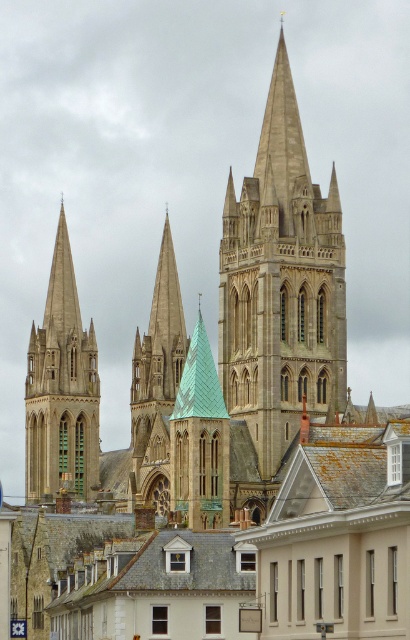
Is the position of light gray stone tower at center more distant than that of stone spire at left?

That is False.

Is point (282, 248) behind point (38, 461)?

No, (282, 248) is in front of (38, 461).

Describe the element at coordinates (280, 284) in the screenshot. I see `light gray stone tower at center` at that location.

Where is `light gray stone tower at center`? This screenshot has height=640, width=410. light gray stone tower at center is located at coordinates (280, 284).

In the scene shown: Is stone spire at left to the left of gray slate roof at center from the viewer's perspective?

Yes, stone spire at left is to the left of gray slate roof at center.

Which of these two, stone spire at left or gray slate roof at center, stands shorter?

With less height is gray slate roof at center.

This screenshot has width=410, height=640. Find the location of `stone spire at left`. stone spire at left is located at coordinates (61, 388).

Does light gray stone tower at center have a greater height compared to gray slate roof at center?

Indeed, light gray stone tower at center has a greater height compared to gray slate roof at center.

Can you confirm if light gray stone tower at center is positioned above gray slate roof at center?

Correct, light gray stone tower at center is located above gray slate roof at center.

I want to click on light gray stone tower at center, so click(x=280, y=284).

Locate an element on the screen. light gray stone tower at center is located at coordinates (280, 284).